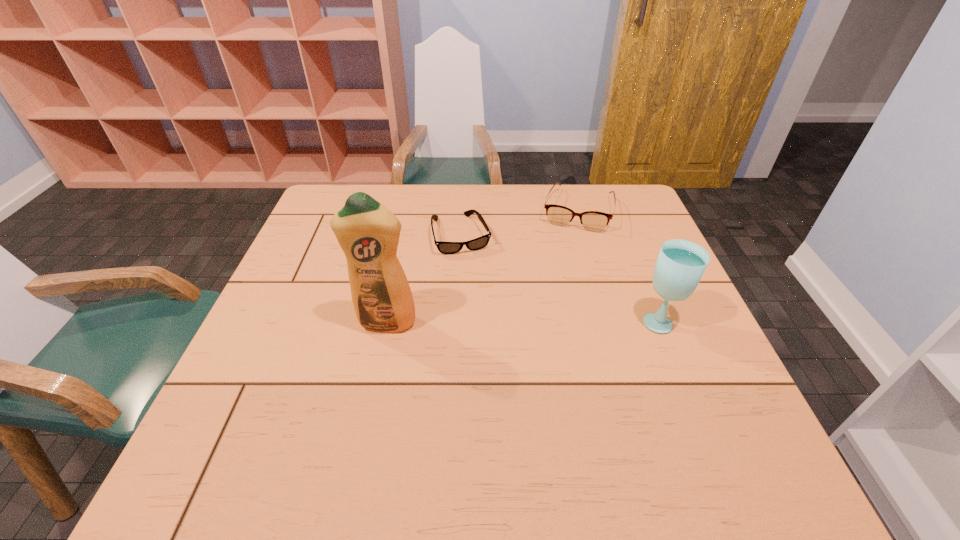
Find the location of a particular element. Image resolution: width=960 pixels, height=540 pixels. vacant space at the near edge is located at coordinates (359, 392).

Find the location of a particular element. The width and height of the screenshot is (960, 540). vacant area at the left edge of the desktop is located at coordinates [x=294, y=312].

I want to click on vacant space at the right edge, so click(x=619, y=240).

What are the coordinates of `free location at the far right corner of the desktop` in the screenshot? It's located at (636, 193).

Where is `vacant space at the near right corner of the desktop`? Image resolution: width=960 pixels, height=540 pixels. vacant space at the near right corner of the desktop is located at coordinates (708, 396).

The width and height of the screenshot is (960, 540). I want to click on free space between the second shortest object and the tallest object, so click(482, 267).

Locate an element on the screen. The width and height of the screenshot is (960, 540). free space between the sunglasses and the glass is located at coordinates (561, 278).

Where is `free point between the detergent and the glass`? free point between the detergent and the glass is located at coordinates (523, 321).

Locate an element on the screen. The width and height of the screenshot is (960, 540). empty location between the spectacles and the sunglasses is located at coordinates (519, 222).

Locate an element on the screen. vacant region between the third tallest object and the sunglasses is located at coordinates coord(519,222).